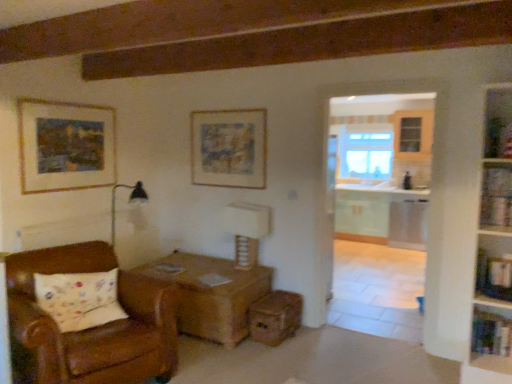
Describe the element at coordinates (365, 152) in the screenshot. I see `clear glass window at center` at that location.

The image size is (512, 384). I want to click on wooden picture frame at upper left, which ranks as the second picture frame in right-to-left order, so click(65, 146).

Identify the location of white textured table lamp at center. (246, 230).

Find the location of a particular element. Image resolution: width=512 pixels, height=384 pixels. brown leather chair at lower left is located at coordinates (92, 328).

Can you confirm if wooden drawer at lower center is smaller than wooden shelf at lower right, the 3th shelf when ordered from top to bottom?

Actually, wooden drawer at lower center might be larger than wooden shelf at lower right, the 3th shelf when ordered from top to bottom.

Is point (266, 324) positioned in front of point (490, 339)?

No, (266, 324) is further to viewer.

Which is behind, wooden drawer at lower center or wooden shelf at lower right, the 3th shelf when ordered from top to bottom?

Positioned behind is wooden drawer at lower center.

Is wooden drawer at lower center with wooden shelf at lower right, which is the 1th shelf from bottom to top?

No, wooden drawer at lower center is not making contact with wooden shelf at lower right, which is the 1th shelf from bottom to top.

Considering the relative positions of matte paper picture frame at upper center, which ranks as the second picture frame in left-to-right order, and white textured table lamp at center in the image provided, is matte paper picture frame at upper center, which ranks as the second picture frame in left-to-right order, to the right of white textured table lamp at center from the viewer's perspective?

Incorrect, matte paper picture frame at upper center, which ranks as the second picture frame in left-to-right order, is not on the right side of white textured table lamp at center.

Where is `picture frame that is the 1st one above the white textured table lamp at center (from a real-world perspective)`? This screenshot has width=512, height=384. picture frame that is the 1st one above the white textured table lamp at center (from a real-world perspective) is located at coordinates (229, 148).

Which of these two, matte paper picture frame at upper center, the first picture frame viewed from the right, or white textured table lamp at center, stands shorter?

white textured table lamp at center is shorter.

Is wooden bookshelf at upper right, the third shelf ordered from the bottom, facing away from wooden picture frame at upper left, the first picture frame positioned from the left?

No.

Is wooden picture frame at upper left, which ranks as the second picture frame in right-to-left order, surrounded by wooden bookshelf at upper right, the third shelf ordered from the bottom?

No, wooden picture frame at upper left, which ranks as the second picture frame in right-to-left order, is not a part of wooden bookshelf at upper right, the third shelf ordered from the bottom.

Which is behind, wooden bookshelf at upper right, the third shelf ordered from the bottom, or wooden picture frame at upper left, which ranks as the second picture frame in right-to-left order?

Positioned behind is wooden picture frame at upper left, which ranks as the second picture frame in right-to-left order.

In the scene shown: Which of these two, wooden bookshelf at upper right, the third shelf ordered from the bottom, or wooden picture frame at upper left, the first picture frame positioned from the left, stands taller?

wooden picture frame at upper left, the first picture frame positioned from the left.

Between brown leather chair at lower left and wooden picture frame at upper left, the first picture frame positioned from the left, which one appears on the right side from the viewer's perspective?

Positioned to the right is brown leather chair at lower left.

From a real-world perspective, does brown leather chair at lower left stand above wooden picture frame at upper left, which ranks as the second picture frame in right-to-left order?

No, from a real-world perspective, brown leather chair at lower left is not on top of wooden picture frame at upper left, which ranks as the second picture frame in right-to-left order.

Does brown leather chair at lower left come in front of wooden picture frame at upper left, which ranks as the second picture frame in right-to-left order?

That is True.

Is clear glass window at center at the back of wooden drawer at lower center?

wooden drawer at lower center is not turned away from clear glass window at center.

From the image's perspective, is wooden drawer at lower center above or below clear glass window at center?

From the image's perspective, wooden drawer at lower center appears below clear glass window at center.

Is wooden drawer at lower center surrounding clear glass window at center?

Actually, clear glass window at center is outside wooden drawer at lower center.

Between wooden drawer at lower center and clear glass window at center, which one appears on the right side from the viewer's perspective?

clear glass window at center is more to the right.

Does clear glass window at center have a smaller size compared to wooden picture frame at upper left, which ranks as the second picture frame in right-to-left order?

No, clear glass window at center is not smaller than wooden picture frame at upper left, which ranks as the second picture frame in right-to-left order.

From a real-world perspective, who is located lower, clear glass window at center or wooden picture frame at upper left, which ranks as the second picture frame in right-to-left order?

clear glass window at center is physically lower.

Between point (362, 127) and point (64, 149), which one is positioned in front?

The point (64, 149) is closer.

From the image's perspective, is clear glass window at center under wooden picture frame at upper left, which ranks as the second picture frame in right-to-left order?

Actually, clear glass window at center appears above wooden picture frame at upper left, which ranks as the second picture frame in right-to-left order, in the image.

Can you tell me how much wooden bookshelf at right, marked as the second shelf in a top-to-bottom arrangement, and clear glass window at center differ in facing direction?

The angle between the facing direction of wooden bookshelf at right, marked as the second shelf in a top-to-bottom arrangement, and the facing direction of clear glass window at center is 0.944 degrees.

Is wooden bookshelf at right, the 2th shelf when ordered from bottom to top, placed right next to clear glass window at center?

No, wooden bookshelf at right, the 2th shelf when ordered from bottom to top, is not making contact with clear glass window at center.

Does wooden bookshelf at right, marked as the second shelf in a top-to-bottom arrangement, contain clear glass window at center?

No, clear glass window at center is not a part of wooden bookshelf at right, marked as the second shelf in a top-to-bottom arrangement.

The width and height of the screenshot is (512, 384). I want to click on drawer that is under the wooden shelf at lower right, which is the 1th shelf from bottom to top (from a real-world perspective), so click(275, 317).

Identify the location of the 2nd picture frame positioned above the white textured table lamp at center (from the image's perspective). The width and height of the screenshot is (512, 384). (229, 148).

From the image, which object appears to be nearer to white textured table lamp at center, wooden bookshelf at right, the 2th shelf when ordered from bottom to top, or wooden shelf at lower right, the 3th shelf when ordered from top to bottom?

wooden bookshelf at right, the 2th shelf when ordered from bottom to top, is closer to white textured table lamp at center.

When comparing their distances from clear glass window at center, does white textured table lamp at center or brown leather chair at lower left seem closer?

white textured table lamp at center is positioned closer to the anchor clear glass window at center.

Which object lies nearer to the anchor point wooden drawer at lower center, wooden picture frame at upper left, the first picture frame positioned from the left, or wooden bookshelf at right, the 2th shelf when ordered from bottom to top?

Based on the image, wooden bookshelf at right, the 2th shelf when ordered from bottom to top, appears to be nearer to wooden drawer at lower center.

From the image, which object appears to be farther from brown leather chair at lower left, wooden bookshelf at right, the 2th shelf when ordered from bottom to top, or wooden shelf at lower right, the 3th shelf when ordered from top to bottom?

Based on the image, wooden bookshelf at right, the 2th shelf when ordered from bottom to top, appears to be further to brown leather chair at lower left.

Estimate the real-world distances between objects in this image. Which object is closer to wooden shelf at lower right, which is the 1th shelf from bottom to top, white textured table lamp at center or wooden picture frame at upper left, the first picture frame positioned from the left?

white textured table lamp at center lies closer to wooden shelf at lower right, which is the 1th shelf from bottom to top, than the other object.

Estimate the real-world distances between objects in this image. Which object is closer to white textured table lamp at center, wooden bookshelf at upper right, the third shelf ordered from the bottom, or wooden picture frame at upper left, which ranks as the second picture frame in right-to-left order?

wooden picture frame at upper left, which ranks as the second picture frame in right-to-left order, is positioned closer to the anchor white textured table lamp at center.

Based on their spatial positions, is clear glass window at center or wooden bookshelf at right, marked as the second shelf in a top-to-bottom arrangement, further from matte paper picture frame at upper center, which ranks as the second picture frame in left-to-right order?

The object further to matte paper picture frame at upper center, which ranks as the second picture frame in left-to-right order, is clear glass window at center.

Which object lies further to the anchor point wooden picture frame at upper left, the first picture frame positioned from the left, matte paper picture frame at upper center, the first picture frame viewed from the right, or wooden drawer at lower center?

The object further to wooden picture frame at upper left, the first picture frame positioned from the left, is wooden drawer at lower center.

Find the location of `drawer situated between white textured table lamp at center and wooden bookshelf at upper right, marked as the first shelf in a top-to-bottom arrangement, from left to right`. drawer situated between white textured table lamp at center and wooden bookshelf at upper right, marked as the first shelf in a top-to-bottom arrangement, from left to right is located at coordinates (275, 317).

Where is `table lamp between matte paper picture frame at upper center, which ranks as the second picture frame in left-to-right order, and wooden drawer at lower center from top to bottom`? This screenshot has height=384, width=512. table lamp between matte paper picture frame at upper center, which ranks as the second picture frame in left-to-right order, and wooden drawer at lower center from top to bottom is located at coordinates (246, 230).

Image resolution: width=512 pixels, height=384 pixels. What are the coordinates of `picture frame located between brown leather chair at lower left and wooden bookshelf at right, marked as the second shelf in a top-to-bottom arrangement, in the left-right direction` in the screenshot? It's located at (229, 148).

Identify the location of drawer positioned between wooden bookshelf at upper right, the third shelf ordered from the bottom, and clear glass window at center from near to far. (275, 317).